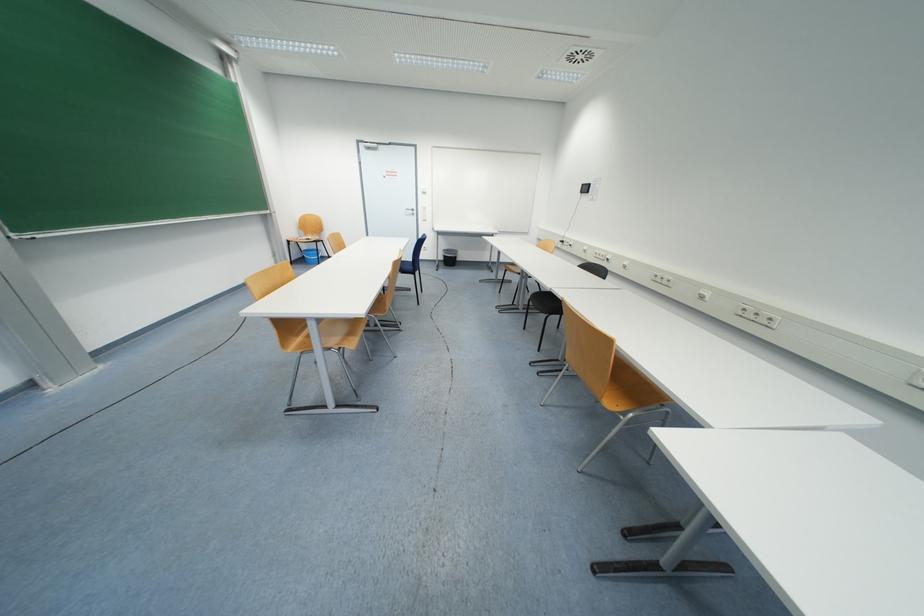
Which object does [448,257] point to?

It refers to a black trash can.